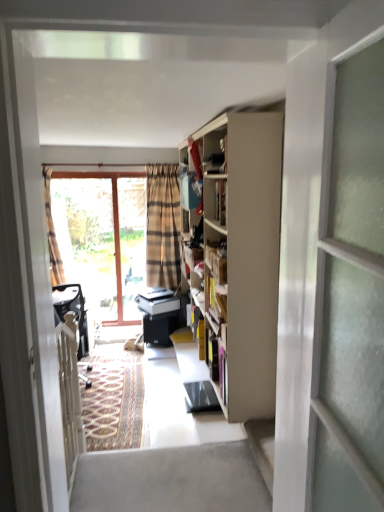
Question: Can you confirm if translucent glass window at left is wider than plaid fabric curtain at left?

Choices:
 (A) yes
 (B) no

Answer: (B)

Question: Considering the relative positions of translucent glass window at left and plaid fabric curtain at left in the image provided, is translucent glass window at left to the right of plaid fabric curtain at left from the viewer's perspective?

Choices:
 (A) no
 (B) yes

Answer: (B)

Question: Can you confirm if translucent glass window at left is taller than plaid fabric curtain at left?

Choices:
 (A) no
 (B) yes

Answer: (B)

Question: From a real-world perspective, is translucent glass window at left beneath plaid fabric curtain at left?

Choices:
 (A) no
 (B) yes

Answer: (B)

Question: Is the depth of translucent glass window at left less than that of plaid fabric curtain at left?

Choices:
 (A) no
 (B) yes

Answer: (A)

Question: In terms of height, does translucent glass window at left look taller or shorter compared to plaid fabric curtain at left?

Choices:
 (A) short
 (B) tall

Answer: (B)

Question: Does point (61, 248) appear closer or farther from the camera than point (51, 170)?

Choices:
 (A) farther
 (B) closer

Answer: (A)

Question: Considering their positions, is translucent glass window at left located in front of or behind plaid fabric curtain at left?

Choices:
 (A) behind
 (B) front

Answer: (A)

Question: From a real-world perspective, is translucent glass window at left positioned above or below plaid fabric curtain at left?

Choices:
 (A) above
 (B) below

Answer: (B)

Question: Is plaid fabric curtain at left bigger or smaller than translucent glass window at left?

Choices:
 (A) small
 (B) big

Answer: (A)

Question: Would you say plaid fabric curtain at left is to the left or to the right of translucent glass window at left in the picture?

Choices:
 (A) left
 (B) right

Answer: (A)

Question: Relative to translucent glass window at left, is plaid fabric curtain at left in front or behind?

Choices:
 (A) front
 (B) behind

Answer: (A)

Question: Does point (48, 199) appear closer or farther from the camera than point (97, 286)?

Choices:
 (A) farther
 (B) closer

Answer: (B)

Question: Looking at their shapes, would you say smooth concrete step at lower right is wider or thinner than matte wooden cabinet at upper center?

Choices:
 (A) thin
 (B) wide

Answer: (A)

Question: From their relative heights in the image, would you say smooth concrete step at lower right is taller or shorter than matte wooden cabinet at upper center?

Choices:
 (A) tall
 (B) short

Answer: (B)